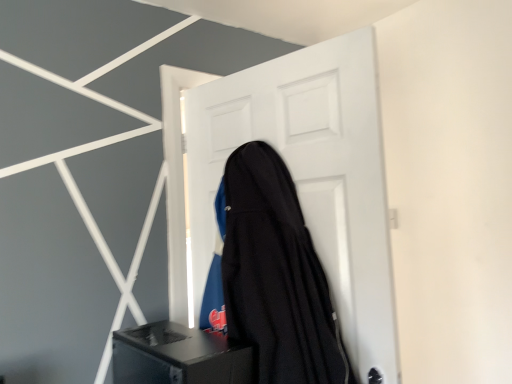
The image size is (512, 384). Describe the element at coordinates (178, 356) in the screenshot. I see `black matte speaker at lower center` at that location.

In the scene shown: What is the approximate width of black matte speaker at lower center?

black matte speaker at lower center is 42.61 centimeters in width.

This screenshot has height=384, width=512. In order to click on white matte door at center in this screenshot , I will do `click(310, 176)`.

Locate an element on the screen. Image resolution: width=512 pixels, height=384 pixels. black matte speaker at lower center is located at coordinates (178, 356).

Is black matte speaker at lower center aimed at white matte door at center?

No, black matte speaker at lower center is not aimed at white matte door at center.

From the picture: Considering the sizes of objects black matte speaker at lower center and white matte door at center in the image provided, who is shorter, black matte speaker at lower center or white matte door at center?

Standing shorter between the two is black matte speaker at lower center.

Based on the photo, which object is positioned more to the left, black matte speaker at lower center or white matte door at center?

black matte speaker at lower center is more to the left.

Is point (348, 94) positioned before point (298, 206)?

Yes, point (348, 94) is in front of point (298, 206).

The width and height of the screenshot is (512, 384). In the image, there is a black fabric guitar case at center. Identify the location of door above it (from the image's perspective). (310, 176).

From a real-world perspective, which object stands above the other?

From a 3D spatial view, white matte door at center is above.

Is white matte door at center turned away from black fabric guitar case at center?

Yes, white matte door at center is facing away from black fabric guitar case at center.

Is black matte speaker at lower center aimed at black fabric guitar case at center?

No.

Does black matte speaker at lower center lie behind black fabric guitar case at center?

No, it is in front of black fabric guitar case at center.

The width and height of the screenshot is (512, 384). I want to click on furniture below the black fabric guitar case at center (from a real-world perspective), so click(x=178, y=356).

Can you confirm if black matte speaker at lower center is shorter than black fabric guitar case at center?

Indeed, black matte speaker at lower center has a lesser height compared to black fabric guitar case at center.

Is white matte door at center taller than black matte speaker at lower center?

Indeed, white matte door at center has a greater height compared to black matte speaker at lower center.

Is white matte door at center not near black matte speaker at lower center?

No, white matte door at center is not far from black matte speaker at lower center.

Considering the relative positions of white matte door at center and black matte speaker at lower center in the image provided, is white matte door at center to the left or to the right of black matte speaker at lower center?

white matte door at center is to the right of black matte speaker at lower center.

Does white matte door at center lie in front of black matte speaker at lower center?

No.

Between point (275, 170) and point (135, 346), which one is positioned in front?

The point (275, 170) is closer to the camera.

Which object is further away from the camera, black fabric guitar case at center or black matte speaker at lower center?

black fabric guitar case at center is further away from the camera.

From the image's perspective, which is above, black fabric guitar case at center or black matte speaker at lower center?

black fabric guitar case at center.

Is black fabric guitar case at center to the left or to the right of black matte speaker at lower center in the image?

Based on their positions, black fabric guitar case at center is located to the right of black matte speaker at lower center.

Does black fabric guitar case at center come in front of white matte door at center?

Yes, it is.

Are black fabric guitar case at center and white matte door at center located far from each other?

No, black fabric guitar case at center is not far away from white matte door at center.

Is white matte door at center located within black fabric guitar case at center?

→ Definitely not — white matte door at center is not inside black fabric guitar case at center.

This screenshot has height=384, width=512. I want to click on door above the black matte speaker at lower center (from a real-world perspective), so click(310, 176).

Where is `door behind the black fabric guitar case at center`? door behind the black fabric guitar case at center is located at coordinates (310, 176).

Estimate the real-world distances between objects in this image. Which object is further from white matte door at center, black fabric guitar case at center or black matte speaker at lower center?

Based on the image, black matte speaker at lower center appears to be further to white matte door at center.

Based on their spatial positions, is white matte door at center or black matte speaker at lower center further from black fabric guitar case at center?

black matte speaker at lower center is positioned further to the anchor black fabric guitar case at center.

In the scene shown: Estimate the real-world distances between objects in this image. Which object is closer to black matte speaker at lower center, black fabric guitar case at center or white matte door at center?

Based on the image, black fabric guitar case at center appears to be nearer to black matte speaker at lower center.

Considering their positions, is black matte speaker at lower center positioned further to white matte door at center than black fabric guitar case at center?

The object further to white matte door at center is black matte speaker at lower center.

When comparing their distances from black fabric guitar case at center, does black matte speaker at lower center or white matte door at center seem closer?

white matte door at center lies closer to black fabric guitar case at center than the other object.

When comparing their distances from black matte speaker at lower center, does white matte door at center or black fabric guitar case at center seem closer?

black fabric guitar case at center is positioned closer to the anchor black matte speaker at lower center.

The image size is (512, 384). Identify the location of garment between white matte door at center and black matte speaker at lower center vertically. (276, 275).